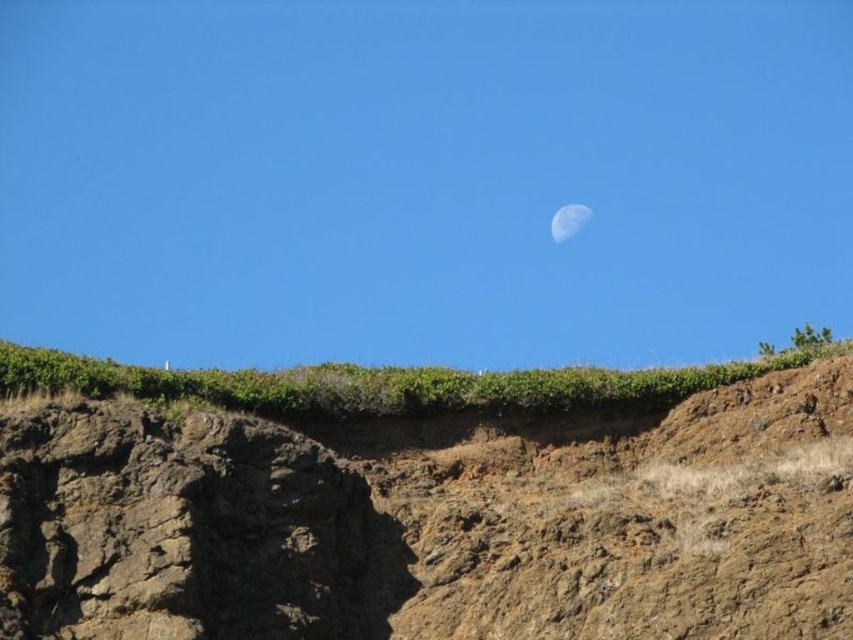
Who is positioned more to the right, brown rocky cliff at upper center or satin white moon at upper center?

satin white moon at upper center is more to the right.

Which of these two, brown rocky cliff at upper center or satin white moon at upper center, stands taller?

brown rocky cliff at upper center

The width and height of the screenshot is (853, 640). I want to click on brown rocky cliff at upper center, so click(x=426, y=502).